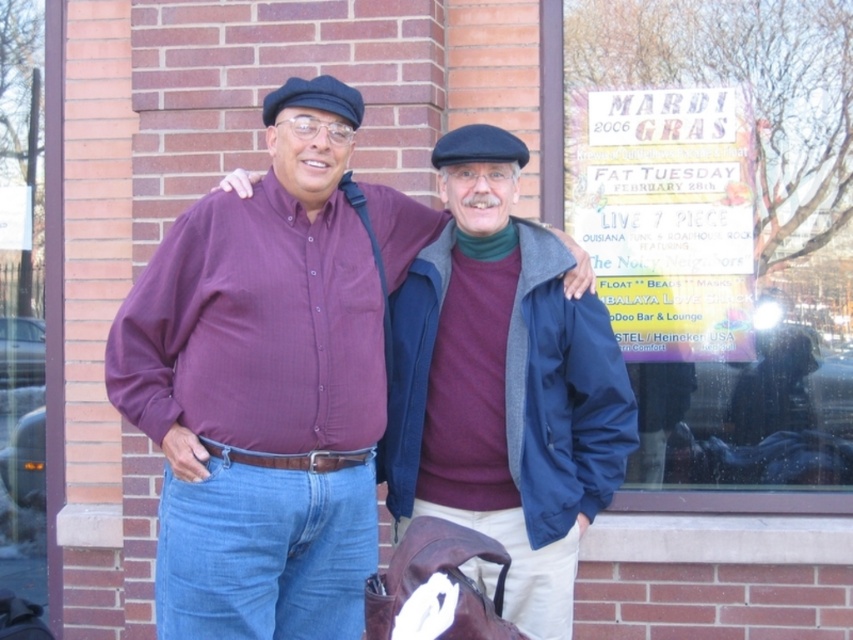
Question: Is matte purple shirt at center closer to camera compared to maroon sweater at center?

Choices:
 (A) yes
 (B) no

Answer: (B)

Question: Is matte purple shirt at center above maroon sweater at center?

Choices:
 (A) yes
 (B) no

Answer: (A)

Question: Does matte purple shirt at center appear under maroon sweater at center?

Choices:
 (A) no
 (B) yes

Answer: (A)

Question: Which point is farther to the camera?

Choices:
 (A) (590, 428)
 (B) (189, 268)

Answer: (A)